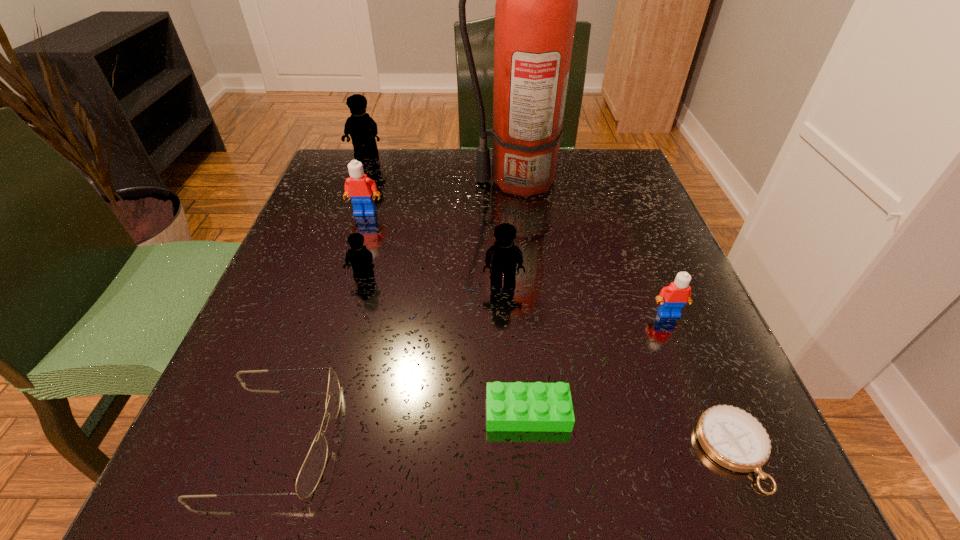
This screenshot has height=540, width=960. I want to click on free space between the tallest object and the beige spectacles, so 396,309.

Where is `empty space between the beige spectacles and the shortest object`? The width and height of the screenshot is (960, 540). empty space between the beige spectacles and the shortest object is located at coordinates (504, 443).

Where is `free space that is in between the sixth farthest object and the biggest yellow Lego`? The width and height of the screenshot is (960, 540). free space that is in between the sixth farthest object and the biggest yellow Lego is located at coordinates [517, 234].

Select which object is the seventh closest to the rightmost yellow Lego. Please provide its 2D coordinates. Your answer should be formatted as a tuple, i.e. [(x, y)], where the tuple contains the x and y coordinates of a point satisfying the conditions above.

[(733, 438)]

Choose which object is the second nearest neighbor to the fourth nearest object. Please provide its 2D coordinates. Your answer should be formatted as a tuple, i.e. [(x, y)], where the tuple contains the x and y coordinates of a point satisfying the conditions above.

[(503, 256)]

Choose which Lego is the third nearest neighbor to the farthest object. Please provide its 2D coordinates. Your answer should be formatted as a tuple, i.e. [(x, y)], where the tuple contains the x and y coordinates of a point satisfying the conditions above.

[(503, 256)]

At what (x,y) coordinates should I click in order to perform the action: click on the second closest Lego relative to the farthest Lego. Please return your answer as a coordinate pair (x, y). Looking at the image, I should click on (360, 258).

Locate an element on the screen. yellow Lego object that ranks as the closest to the smallest yellow Lego is located at coordinates (503, 256).

Select which yellow Lego is the closest to the second yellow Lego from right to left. Please provide its 2D coordinates. Your answer should be formatted as a tuple, i.e. [(x, y)], where the tuple contains the x and y coordinates of a point satisfying the conditions above.

[(503, 256)]

Where is `free space that satisfies the following two spatial constraints: 1. on the face of the compass; 2. on the left side of the left white Lego`? This screenshot has height=540, width=960. free space that satisfies the following two spatial constraints: 1. on the face of the compass; 2. on the left side of the left white Lego is located at coordinates (290, 450).